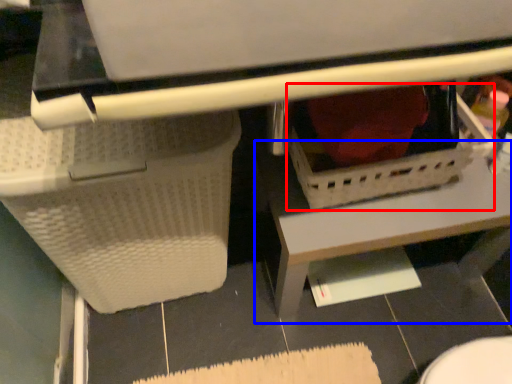
Question: Which point is closer to the camera, basket (highlighted by a red box) or table (highlighted by a blue box)?

Choices:
 (A) basket
 (B) table

Answer: (A)